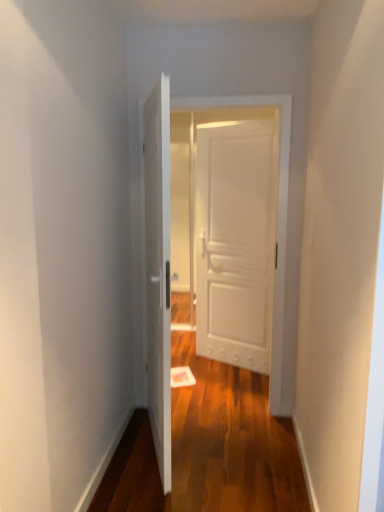
Question: From the image's perspective, is white matte door at center, placed as the first door when sorted from back to front, on top of white matte door at center, which is the third door in back-to-front order?

Choices:
 (A) no
 (B) yes

Answer: (B)

Question: Is white matte door at center, placed as the first door when sorted from back to front, looking in the opposite direction of white matte door at center, which is the third door in back-to-front order?

Choices:
 (A) no
 (B) yes

Answer: (A)

Question: From the image's perspective, is white matte door at center, placed as the first door when sorted from back to front, beneath white matte door at center, which is the third door in back-to-front order?

Choices:
 (A) yes
 (B) no

Answer: (B)

Question: Is white matte door at center, which is the third door from front to back, bigger than white matte door at center, positioned as the first door in front-to-back order?

Choices:
 (A) yes
 (B) no

Answer: (B)

Question: Is the surface of white matte door at center, which is the third door from front to back, in direct contact with white matte door at center, which is the third door in back-to-front order?

Choices:
 (A) yes
 (B) no

Answer: (B)

Question: Is the position of white matte door at center, placed as the first door when sorted from back to front, less distant than that of white matte door at center, positioned as the first door in front-to-back order?

Choices:
 (A) no
 (B) yes

Answer: (A)

Question: Could you tell me if white wooden door at center, the second door from the back, is facing white matte door at center, positioned as the first door in front-to-back order?

Choices:
 (A) no
 (B) yes

Answer: (B)

Question: Considering the relative sizes of white wooden door at center, which appears as the 2th door when viewed from the front, and white matte door at center, which is the third door in back-to-front order, in the image provided, is white wooden door at center, which appears as the 2th door when viewed from the front, shorter than white matte door at center, which is the third door in back-to-front order,?

Choices:
 (A) no
 (B) yes

Answer: (A)

Question: From a real-world perspective, is white wooden door at center, which appears as the 2th door when viewed from the front, beneath white matte door at center, which is the third door in back-to-front order?

Choices:
 (A) no
 (B) yes

Answer: (A)

Question: Is white wooden door at center, which appears as the 2th door when viewed from the front, next to white matte door at center, which is the third door in back-to-front order, and touching it?

Choices:
 (A) yes
 (B) no

Answer: (B)

Question: From the image's perspective, is white wooden door at center, which appears as the 2th door when viewed from the front, on white matte door at center, positioned as the first door in front-to-back order?

Choices:
 (A) yes
 (B) no

Answer: (A)

Question: Is white wooden door at center, which appears as the 2th door when viewed from the front, closer to the viewer compared to white matte door at center, positioned as the first door in front-to-back order?

Choices:
 (A) no
 (B) yes

Answer: (A)

Question: From a real-world perspective, does white matte door at center, positioned as the first door in front-to-back order, sit lower than white wooden door at center, which appears as the 2th door when viewed from the front?

Choices:
 (A) yes
 (B) no

Answer: (A)